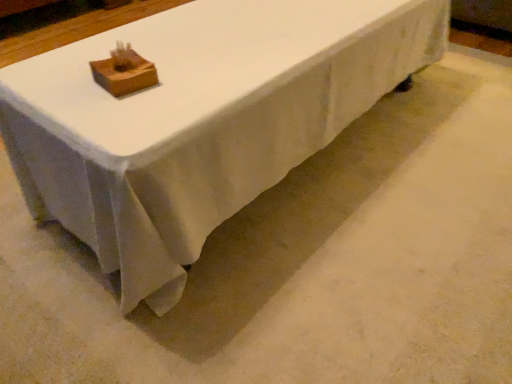
Question: Considering the relative sizes of wooden block at upper center and white fabric table at center in the image provided, is wooden block at upper center shorter than white fabric table at center?

Choices:
 (A) yes
 (B) no

Answer: (A)

Question: Can you confirm if wooden block at upper center is smaller than white fabric table at center?

Choices:
 (A) yes
 (B) no

Answer: (A)

Question: Is wooden block at upper center bigger than white fabric table at center?

Choices:
 (A) yes
 (B) no

Answer: (B)

Question: Would you say wooden block at upper center is outside white fabric table at center?

Choices:
 (A) no
 (B) yes

Answer: (B)

Question: Is wooden block at upper center positioned with its back to white fabric table at center?

Choices:
 (A) no
 (B) yes

Answer: (A)

Question: Is wooden block at upper center not near white fabric table at center?

Choices:
 (A) yes
 (B) no

Answer: (B)

Question: Can you confirm if white fabric table at center is shorter than wooden block at upper center?

Choices:
 (A) yes
 (B) no

Answer: (B)

Question: From a real-world perspective, is white fabric table at center located beneath wooden block at upper center?

Choices:
 (A) no
 (B) yes

Answer: (B)

Question: From the image's perspective, is white fabric table at center on top of wooden block at upper center?

Choices:
 (A) no
 (B) yes

Answer: (B)

Question: Does white fabric table at center have a larger size compared to wooden block at upper center?

Choices:
 (A) no
 (B) yes

Answer: (B)

Question: Is the position of white fabric table at center less distant than that of wooden block at upper center?

Choices:
 (A) no
 (B) yes

Answer: (B)

Question: Considering the relative sizes of white fabric table at center and wooden block at upper center in the image provided, is white fabric table at center smaller than wooden block at upper center?

Choices:
 (A) yes
 (B) no

Answer: (B)

Question: Is wooden block at upper center to the left or to the right of white fabric table at center in the image?

Choices:
 (A) left
 (B) right

Answer: (A)